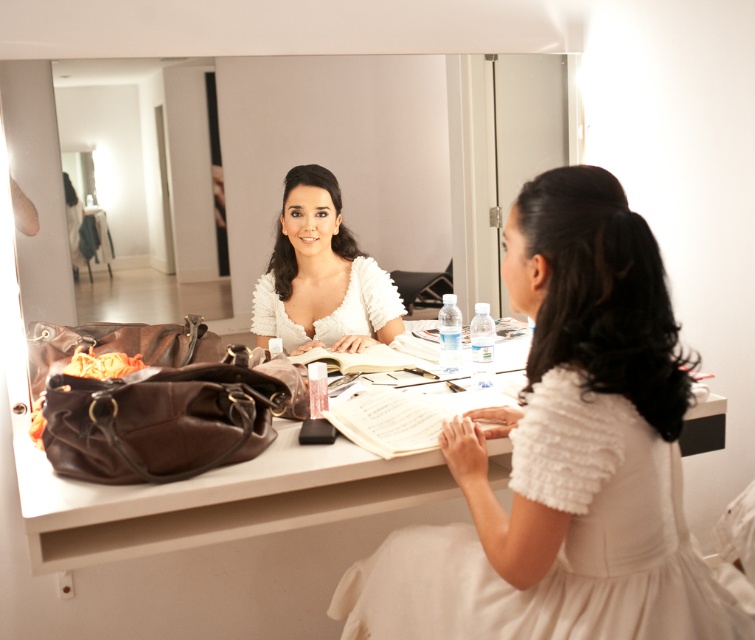
You are a stylist observing the scene. The white fluffy dress at center needs to be displayed on a mannequin placed on the brown leather vanity at center. Given their sizes, will the dress fit on the vanity?

The white fluffy dress at center is taller than the brown leather vanity at center, so it may not fit properly on the vanity without being folded or adjusted.

You are standing in front of the vanity mirror and want to reach both the point at coordinates (296, 61) and the point at coordinates (109, 547). Which point should you extend your hand toward first to touch the one closer to you?

You should first touch the point at coordinates (296, 61) because it is closer to you than the point at coordinates (109, 547).

You are an assistant helping to set up for a performance. You need to place a small bouquet of flowers between the clear glass mirror at upper center and the brown leather vanity at center. Based on their positions, where should the bouquet be placed?

The brown leather vanity at center is behind the clear glass mirror at upper center, so the bouquet should be placed in front of the clear glass mirror at upper center and in front of the brown leather vanity at center to be between them.